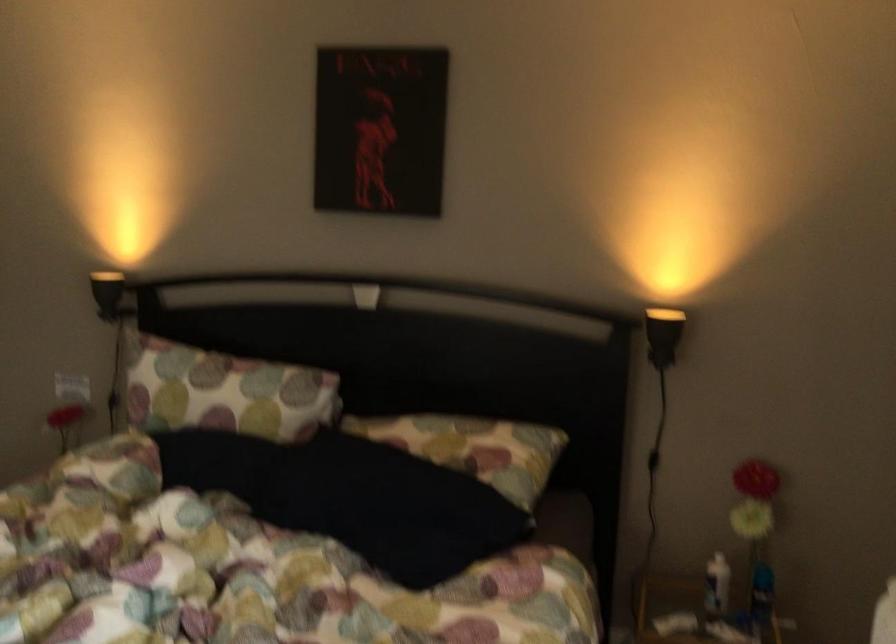
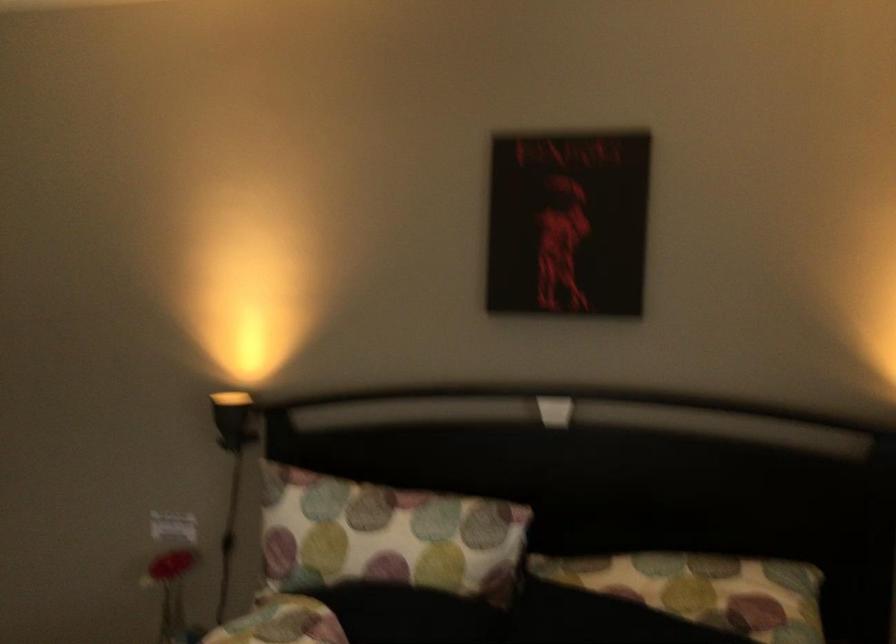
Question: Based on the continuous images, in which direction is the camera rotating? Reply with the corresponding letter.

Choices:
 (A) Left
 (B) Right
 (C) Up
 (D) Down

Answer: (C)